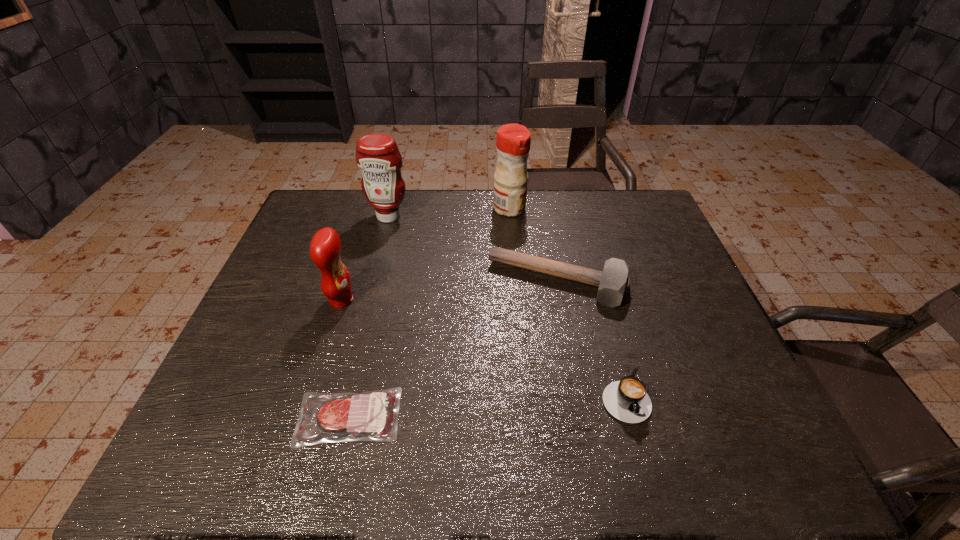
Where is `vacant point that satisfies the following two spatial constraints: 1. on the label side of the steak; 2. on the right side of the nearest condiment`? The height and width of the screenshot is (540, 960). vacant point that satisfies the following two spatial constraints: 1. on the label side of the steak; 2. on the right side of the nearest condiment is located at coordinates click(304, 417).